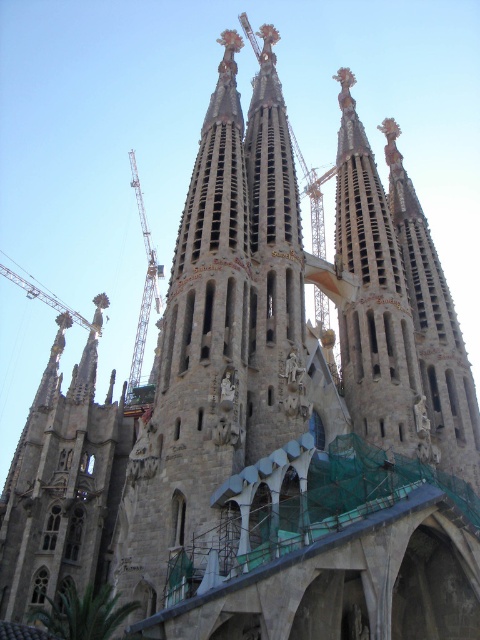
Based on the photo, can you confirm if metallic construction crane at center is smaller than metallic construction crane at upper left?

Actually, metallic construction crane at center might be larger than metallic construction crane at upper left.

Is metallic construction crane at center further to camera compared to metallic construction crane at upper left?

No, it is in front of metallic construction crane at upper left.

Who is more forward, (155, 266) or (72, 314)?

Point (72, 314) is in front.

The width and height of the screenshot is (480, 640). In order to click on metallic construction crane at center in this screenshot , I will do `click(144, 285)`.